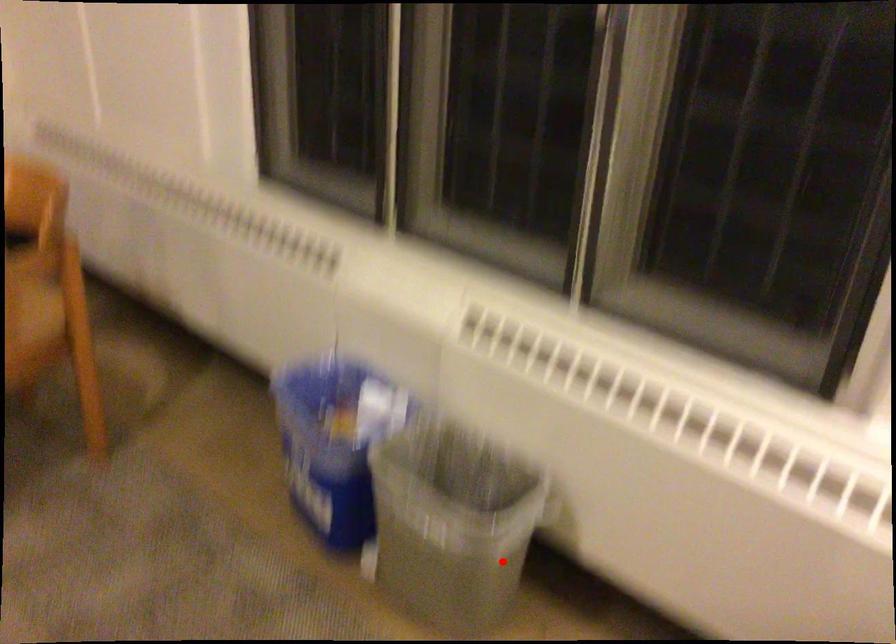
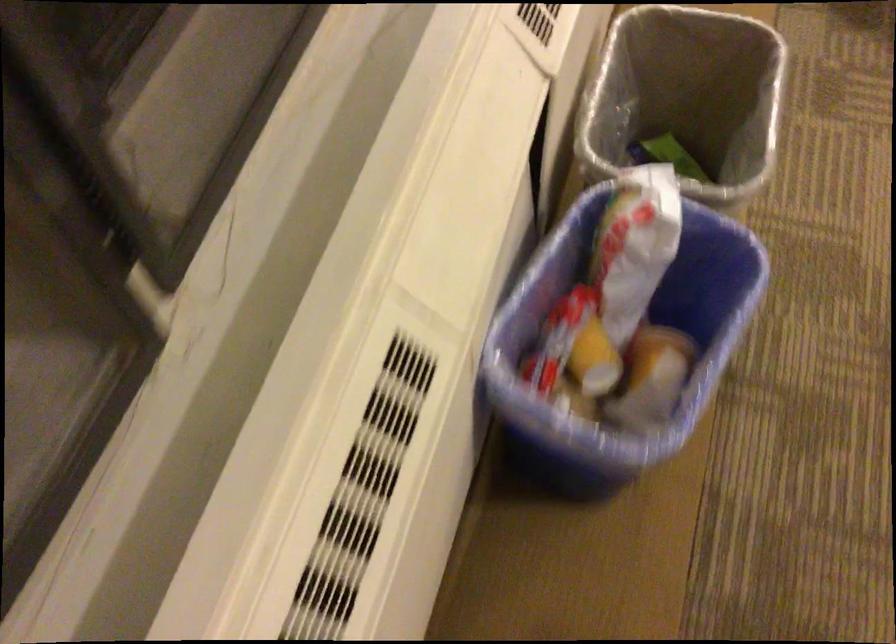
Find the pixel in the second image that matches the highlighted location in the first image.

(686, 97)